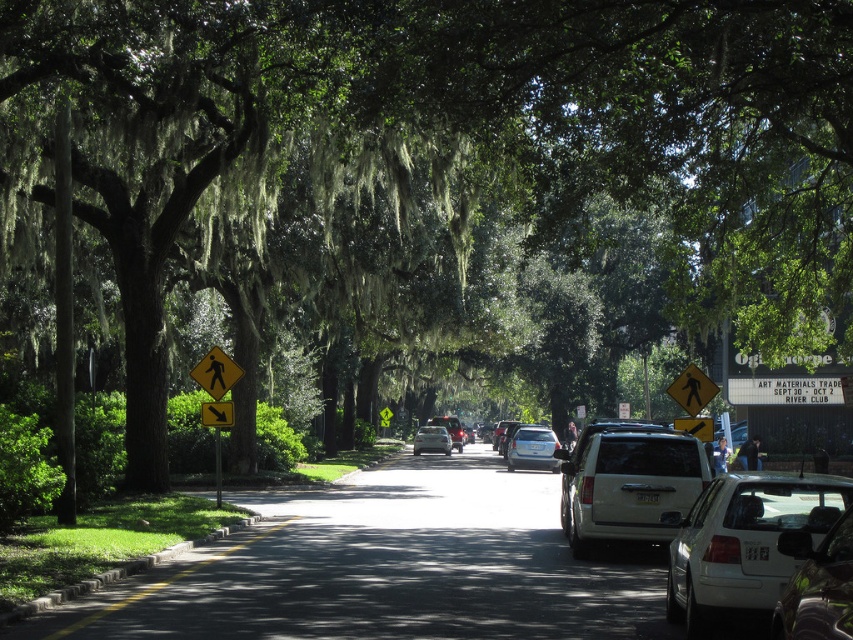
You are a pedestrian standing at the crosswalk and want to cross the street. You see the silver metallic sedan at center and the yellow plastic pedestrian crossing sign at left. Which object is closer to the ground?

The silver metallic sedan at center is located below the yellow plastic pedestrian crossing sign at left, so the silver metallic sedan at center is closer to the ground.

You are a pedestrian standing on the sidewalk and want to cross the street to reach a store across. The yellow painted curb at lower left is where the crosswalk begins. Is the crosswalk above or below the silver metallic sedan at center?

The yellow painted curb at lower left is above the silver metallic sedan at center, so the crosswalk begins above the silver metallic sedan at center.

You are a delivery driver trying to park your truck, which is 1.8 meters tall, in this street. You notice the white matte hatchback at center and the yellow painted curb at lower left. Can your truck pass between them without hitting anything?

The white matte hatchback at center is taller than the yellow painted curb at lower left. Since the truck is 1.8 meters tall, and the curb is shorter than the hatchback, the truck might still hit the hatchback if it is taller than 1.8 meters. However, the exact height of the hatchback isn